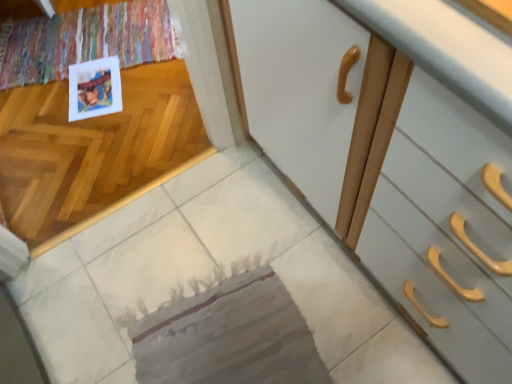
Locate an element on the screen. The height and width of the screenshot is (384, 512). free point behind textured gray mat at center is located at coordinates click(x=203, y=220).